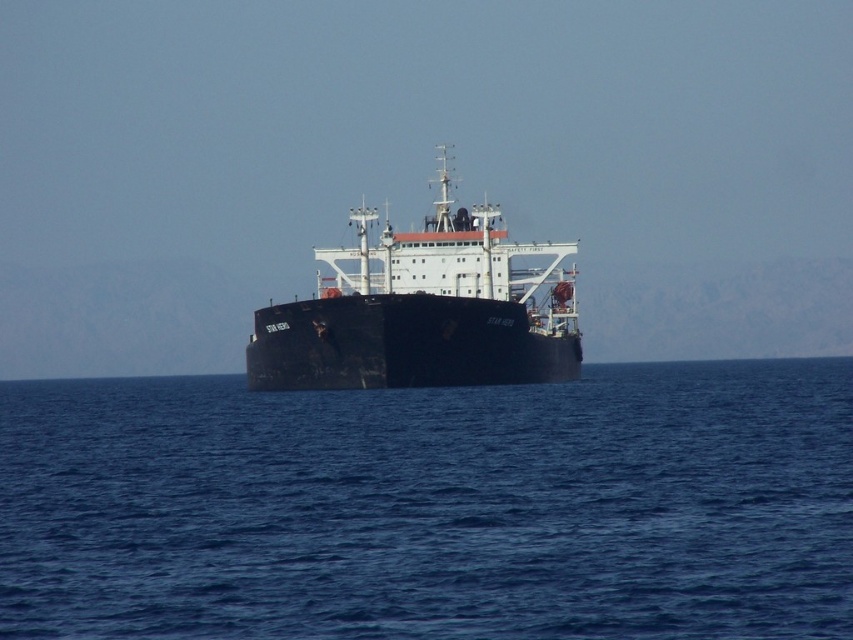
Does blue water at center have a greater height compared to black matte ship at center?

In fact, blue water at center may be shorter than black matte ship at center.

Where is `blue water at center`? This screenshot has height=640, width=853. blue water at center is located at coordinates (432, 508).